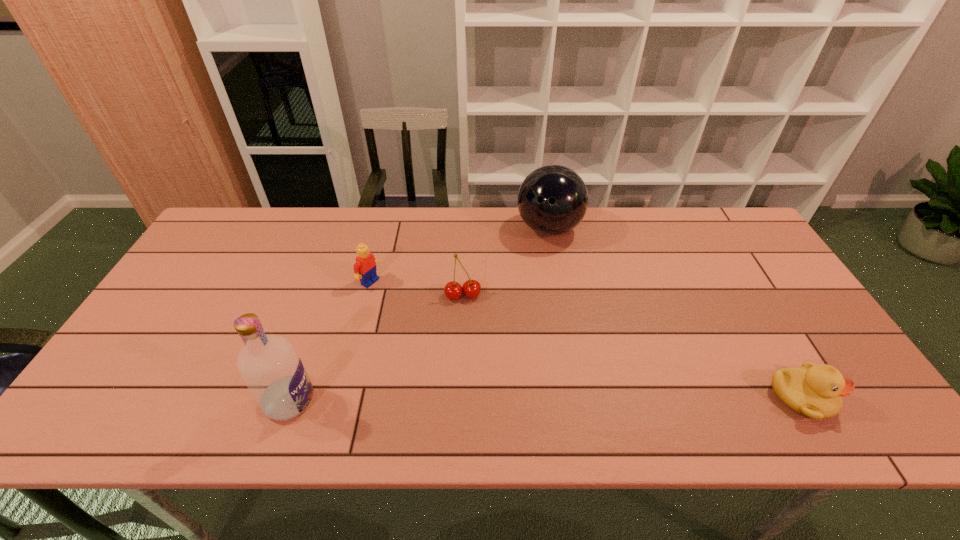
Where is `vacant region between the Lego and the rightmost object`? vacant region between the Lego and the rightmost object is located at coordinates (586, 340).

Find the location of a particular element. The width and height of the screenshot is (960, 540). free space between the third object from right to left and the shortest object is located at coordinates (632, 347).

Where is `free space between the vodka and the cherry`? Image resolution: width=960 pixels, height=540 pixels. free space between the vodka and the cherry is located at coordinates (376, 348).

Where is `vacant region between the fourth object from right to left and the farthest object`? vacant region between the fourth object from right to left and the farthest object is located at coordinates (460, 255).

At what (x,y) coordinates should I click in order to perform the action: click on vacant space in between the second object from right to left and the second object from left to right. Please return your answer as a coordinate pair (x, y). The height and width of the screenshot is (540, 960). Looking at the image, I should click on (460, 255).

Identify the location of vacant space that's between the vodka and the second object from right to left. (420, 315).

The image size is (960, 540). In order to click on the fourth closest object to the farthest object in this screenshot , I will do `click(271, 368)`.

Locate which object ranks in proximity to the leftmost object. Please provide its 2D coordinates. Your answer should be formatted as a tuple, i.e. [(x, y)], where the tuple contains the x and y coordinates of a point satisfying the conditions above.

[(365, 267)]

Identify the location of vacant position in the image that satisfies the following two spatial constraints: 1. on the front side of the Lego; 2. on the front-facing side of the rightmost object. The height and width of the screenshot is (540, 960). (340, 398).

Locate an element on the screen. The height and width of the screenshot is (540, 960). free space that satisfies the following two spatial constraints: 1. on the front side of the third object from right to left; 2. on the right side of the fourth object from right to left is located at coordinates (367, 296).